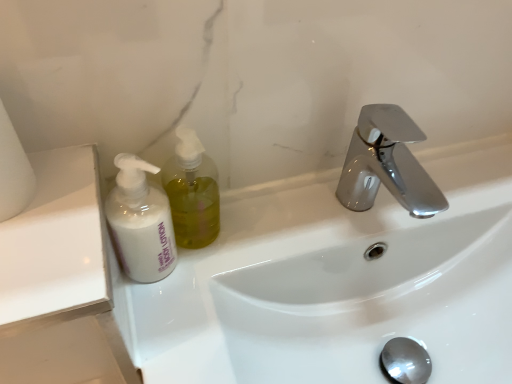
The height and width of the screenshot is (384, 512). In order to click on free location in front of translucent yellow liquid at left in this screenshot , I will do `click(186, 305)`.